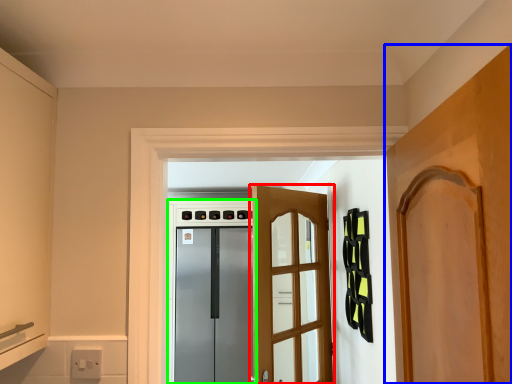
Question: Which object is positioned farthest from door (highlighted by a red box)? Select from door (highlighted by a blue box) and appliance (highlighted by a green box).

Choices:
 (A) door
 (B) appliance

Answer: (B)